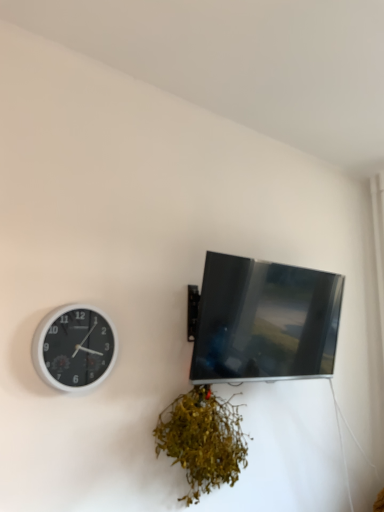
Question: Does white plastic wall clock at left have a larger size compared to matte black tv at upper right?

Choices:
 (A) yes
 (B) no

Answer: (B)

Question: From the image's perspective, is white plastic wall clock at left on top of matte black tv at upper right?

Choices:
 (A) no
 (B) yes

Answer: (A)

Question: Is white plastic wall clock at left looking in the opposite direction of matte black tv at upper right?

Choices:
 (A) yes
 (B) no

Answer: (B)

Question: Is matte black tv at upper right completely or partially inside white plastic wall clock at left?

Choices:
 (A) no
 (B) yes

Answer: (A)

Question: Does white plastic wall clock at left lie behind matte black tv at upper right?

Choices:
 (A) no
 (B) yes

Answer: (A)

Question: Would you say white plastic wall clock at left is a long distance from matte black tv at upper right?

Choices:
 (A) no
 (B) yes

Answer: (A)

Question: Does green leafy plant at lower center come behind matte black tv at upper right?

Choices:
 (A) yes
 (B) no

Answer: (B)

Question: From the image's perspective, would you say green leafy plant at lower center is positioned over matte black tv at upper right?

Choices:
 (A) no
 (B) yes

Answer: (A)

Question: From a real-world perspective, does green leafy plant at lower center stand above matte black tv at upper right?

Choices:
 (A) no
 (B) yes

Answer: (A)

Question: From the image's perspective, is green leafy plant at lower center under matte black tv at upper right?

Choices:
 (A) no
 (B) yes

Answer: (B)

Question: Is green leafy plant at lower center positioned before matte black tv at upper right?

Choices:
 (A) yes
 (B) no

Answer: (A)

Question: Is green leafy plant at lower center surrounding matte black tv at upper right?

Choices:
 (A) no
 (B) yes

Answer: (A)

Question: From a real-world perspective, is matte black tv at upper right located higher than white plastic wall clock at left?

Choices:
 (A) no
 (B) yes

Answer: (B)